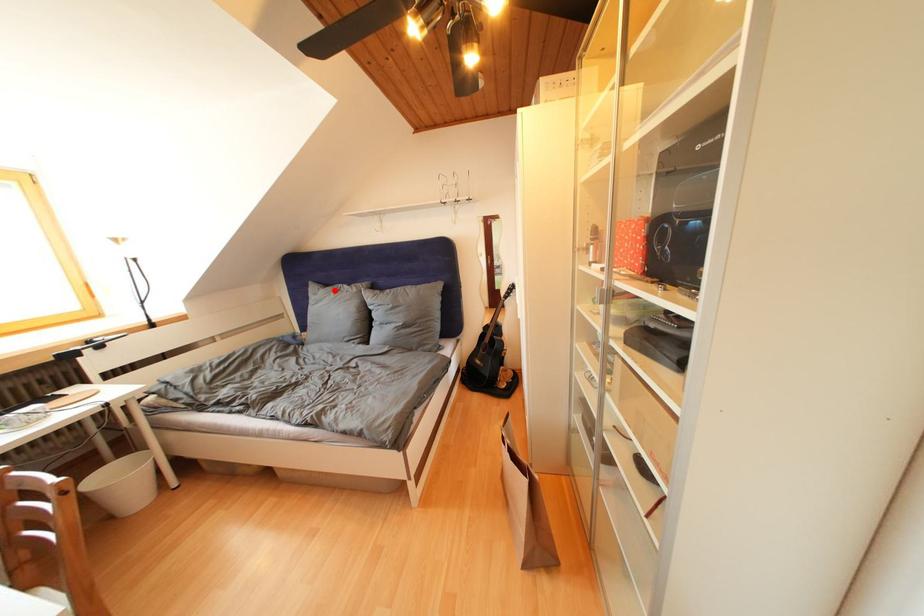
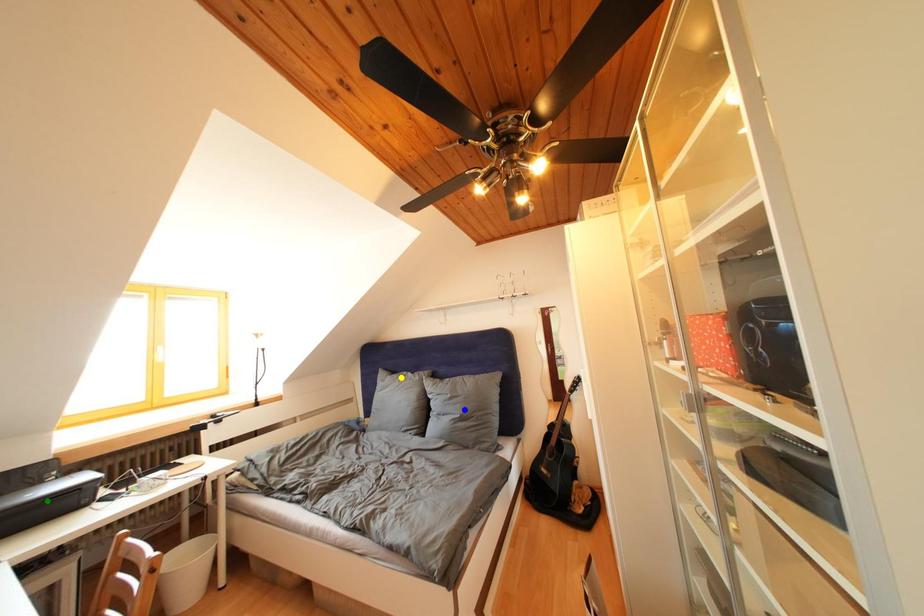
Question: I am providing you with two images of the same scene from different viewpoints. A red point is marked on the first image. You are given multiple points on the second image. Which point in image 2 is actually the same real-world point as the red point in image 1?

Choices:
 (A) yellow point
 (B) green point
 (C) blue point

Answer: (A)